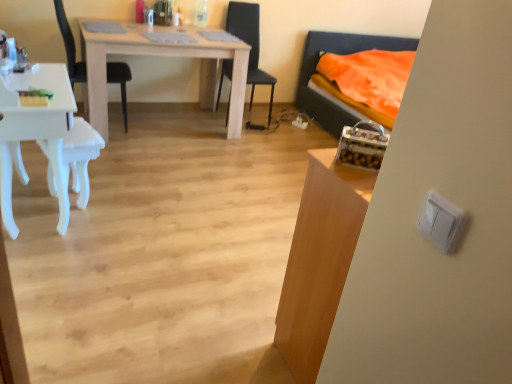
At what (x,y) coordinates should I click in order to perform the action: click on vacant space in front of light wood table at center, which is the 1th table in back-to-front order. Please return your answer as a coordinate pair (x, y). Looking at the image, I should click on (163, 174).